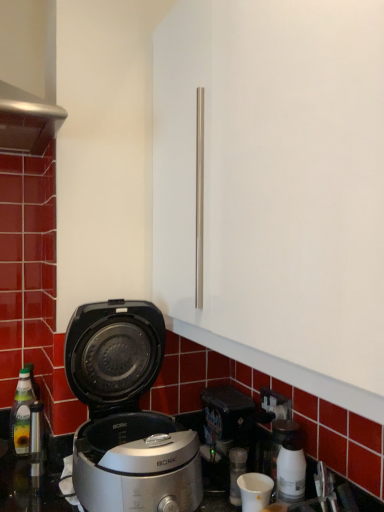
Describe the element at coordinates (126, 414) in the screenshot. This screenshot has height=512, width=384. I see `silver metallic rice cooker at lower left` at that location.

Where is `white glossy coffee machine at lower right`? The image size is (384, 512). white glossy coffee machine at lower right is located at coordinates (288, 461).

Locate an element on the screen. translucent glass bottle at left is located at coordinates (22, 413).

Image resolution: width=384 pixels, height=512 pixels. Describe the element at coordinates (255, 490) in the screenshot. I see `white matte cup at lower center` at that location.

Identify the location of metallic silver countertop at lower center. (15, 483).

Locate an element on the screen. This screenshot has height=512, width=384. silver metallic rice cooker at lower left is located at coordinates (126, 414).

How distant is white glossy coffee machine at lower right from black plastic electric outlet at lower right?

The distance of white glossy coffee machine at lower right from black plastic electric outlet at lower right is 4.82 inches.

From the image's perspective, is white glossy coffee machine at lower right beneath black plastic electric outlet at lower right?

Yes, from the image's perspective, white glossy coffee machine at lower right is beneath black plastic electric outlet at lower right.

Locate an element on the screen. This screenshot has width=384, height=512. coffee machine lying in front of the black plastic electric outlet at lower right is located at coordinates (x=288, y=461).

How different are the orientations of metallic silver countertop at lower center and black plastic electric outlet at lower right in degrees?

The angular difference between metallic silver countertop at lower center and black plastic electric outlet at lower right is 3.1 degrees.

Is metallic silver countertop at lower center bigger than black plastic electric outlet at lower right?

Correct, metallic silver countertop at lower center is larger in size than black plastic electric outlet at lower right.

From the image's perspective, between metallic silver countertop at lower center and black plastic electric outlet at lower right, which one is located above?

black plastic electric outlet at lower right, from the image's perspective.

Is metallic silver countertop at lower center at the left side of black plastic electric outlet at lower right?

Indeed, metallic silver countertop at lower center is positioned on the left side of black plastic electric outlet at lower right.

Considering the relative sizes of silver metallic rice cooker at lower left and metallic silver countertop at lower center in the image provided, is silver metallic rice cooker at lower left thinner than metallic silver countertop at lower center?

Correct, the width of silver metallic rice cooker at lower left is less than that of metallic silver countertop at lower center.

Which is nearer, [146,347] or [18,475]?

Point [146,347] is closer to the camera than point [18,475].

Measure the distance between silver metallic rice cooker at lower left and metallic silver countertop at lower center.

They are 13.99 inches apart.

Is silver metallic rice cooker at lower left taller than metallic silver countertop at lower center?

Indeed, silver metallic rice cooker at lower left has a greater height compared to metallic silver countertop at lower center.

Does metallic silver countertop at lower center turn towards silver metallic rice cooker at lower left?

No, metallic silver countertop at lower center is not oriented towards silver metallic rice cooker at lower left.

Based on the photo, between metallic silver countertop at lower center and silver metallic rice cooker at lower left, which one has more height?

silver metallic rice cooker at lower left is taller.

Considering the relative sizes of metallic silver countertop at lower center and silver metallic rice cooker at lower left in the image provided, is metallic silver countertop at lower center bigger than silver metallic rice cooker at lower left?

Actually, metallic silver countertop at lower center might be smaller than silver metallic rice cooker at lower left.

From a real-world perspective, is metallic silver countertop at lower center on top of silver metallic rice cooker at lower left?

No.

Locate an element on the screen. This screenshot has width=384, height=512. bottle below the white glossy coffee machine at lower right (from the image's perspective) is located at coordinates (22, 413).

Which is more to the right, translucent glass bottle at left or white glossy coffee machine at lower right?

white glossy coffee machine at lower right.

Which of these two, translucent glass bottle at left or white glossy coffee machine at lower right, is bigger?

Bigger between the two is translucent glass bottle at left.

How different are the orientations of translucent glass bottle at left and white glossy coffee machine at lower right in degrees?

They differ by 90 degrees in their facing directions.

Would you consider black plastic electric outlet at lower right to be distant from metallic silver countertop at lower center?

No, there isn't a large distance between black plastic electric outlet at lower right and metallic silver countertop at lower center.

Would you say black plastic electric outlet at lower right is inside or outside metallic silver countertop at lower center?

black plastic electric outlet at lower right is spatially situated outside metallic silver countertop at lower center.

From the image's perspective, is black plastic electric outlet at lower right under metallic silver countertop at lower center?

Actually, black plastic electric outlet at lower right appears above metallic silver countertop at lower center in the image.

Is black plastic electric outlet at lower right spatially inside silver metallic rice cooker at lower left, or outside of it?

black plastic electric outlet at lower right exists outside the volume of silver metallic rice cooker at lower left.

From a real-world perspective, who is located lower, black plastic electric outlet at lower right or silver metallic rice cooker at lower left?

In real-world perspective, black plastic electric outlet at lower right is lower.

Is black plastic electric outlet at lower right wider or thinner than silver metallic rice cooker at lower left?

Clearly, black plastic electric outlet at lower right has less width compared to silver metallic rice cooker at lower left.

From the image's perspective, is black plastic electric outlet at lower right beneath silver metallic rice cooker at lower left?

Answer: Yes, from the image's perspective, black plastic electric outlet at lower right is below silver metallic rice cooker at lower left.

Find the location of `electric outlet located behind the white glossy coffee machine at lower right`. electric outlet located behind the white glossy coffee machine at lower right is located at coordinates (275, 404).

Locate an element on the screen. This screenshot has height=512, width=384. counter top below the black plastic electric outlet at lower right (from the image's perspective) is located at coordinates (15, 483).

Estimate the real-world distances between objects in this image. Which object is closer to black plastic electric outlet at lower right, white matte cup at lower center or translucent glass bottle at left?

white matte cup at lower center is closer to black plastic electric outlet at lower right.

Based on their spatial positions, is metallic silver countertop at lower center or white glossy coffee machine at lower right closer to silver metallic rice cooker at lower left?

metallic silver countertop at lower center lies closer to silver metallic rice cooker at lower left than the other object.

Considering their positions, is white matte cup at lower center positioned closer to silver metallic rice cooker at lower left than metallic silver countertop at lower center?

white matte cup at lower center lies closer to silver metallic rice cooker at lower left than the other object.

When comparing their distances from translucent glass bottle at left, does white glossy coffee machine at lower right or black plastic electric outlet at lower right seem closer?

black plastic electric outlet at lower right is positioned closer to the anchor translucent glass bottle at left.

Considering their positions, is white glossy coffee machine at lower right positioned closer to metallic silver countertop at lower center than translucent glass bottle at left?

translucent glass bottle at left lies closer to metallic silver countertop at lower center than the other object.

Considering their positions, is black plastic electric outlet at lower right positioned closer to metallic silver countertop at lower center than translucent glass bottle at left?

The object closer to metallic silver countertop at lower center is translucent glass bottle at left.

Estimate the real-world distances between objects in this image. Which object is closer to metallic silver countertop at lower center, black plastic electric outlet at lower right or silver metallic rice cooker at lower left?

silver metallic rice cooker at lower left.

Which object lies nearer to the anchor point black plastic electric outlet at lower right, white glossy coffee machine at lower right or metallic silver countertop at lower center?

Based on the image, white glossy coffee machine at lower right appears to be nearer to black plastic electric outlet at lower right.

Where is `counter top located between translucent glass bottle at left and black plastic electric outlet at lower right in the left-right direction`? counter top located between translucent glass bottle at left and black plastic electric outlet at lower right in the left-right direction is located at coordinates (15, 483).

Find the location of `coffee machine between silver metallic rice cooker at lower left and black plastic electric outlet at lower right`. coffee machine between silver metallic rice cooker at lower left and black plastic electric outlet at lower right is located at coordinates (288, 461).

Identify the location of counter top between translucent glass bottle at left and white glossy coffee machine at lower right from left to right. This screenshot has width=384, height=512. (15, 483).

Find the location of a particular element. coffee machine between metallic silver countertop at lower center and black plastic electric outlet at lower right along the z-axis is located at coordinates (288, 461).